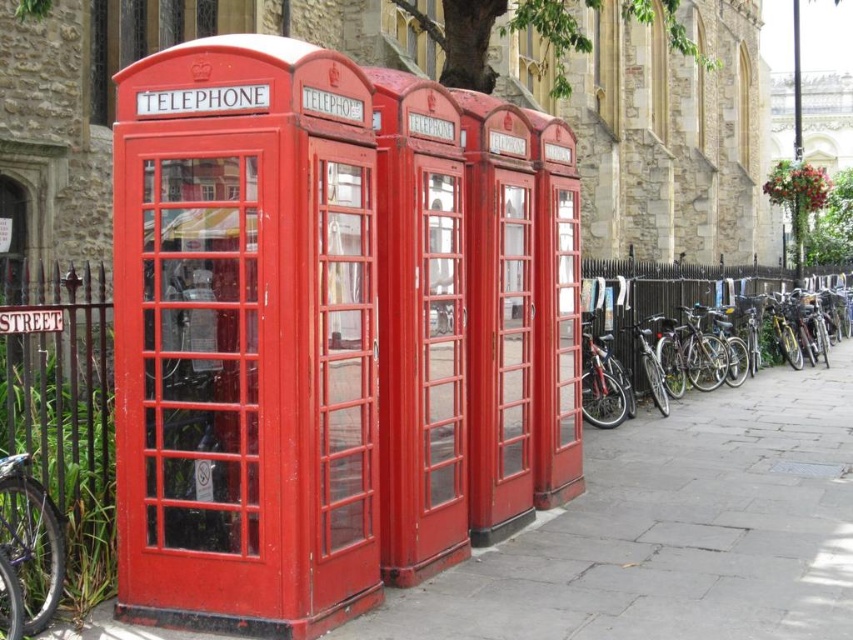
Is matte glass telephone booth at left below metallic purple bicycle at lower left?

Incorrect, matte glass telephone booth at left is not positioned below metallic purple bicycle at lower left.

Is matte glass telephone booth at left taller than metallic purple bicycle at lower left?

Yes.

Find the location of a particular element. The height and width of the screenshot is (640, 853). matte glass telephone booth at left is located at coordinates (245, 339).

Locate an element on the screen. matte glass telephone booth at left is located at coordinates (245, 339).

Which is below, smooth concrete pavement at lower center or shiny metallic bicycle at right?

Positioned lower is smooth concrete pavement at lower center.

Which is in front, point (595, 492) or point (595, 291)?

Point (595, 492)

Where is `smooth concrete pavement at lower center`? Image resolution: width=853 pixels, height=640 pixels. smooth concrete pavement at lower center is located at coordinates (672, 531).

Can you confirm if matte glass telephone booth at left is shorter than shiny metallic bicycle at right?

Incorrect, matte glass telephone booth at left's height does not fall short of shiny metallic bicycle at right's.

Based on the photo, is matte glass telephone booth at left bigger than shiny metallic bicycle at right?

No, matte glass telephone booth at left is not bigger than shiny metallic bicycle at right.

Which is in front, point (248, 116) or point (663, 356)?

Point (248, 116) is in front.

Where is `matte glass telephone booth at left`? The height and width of the screenshot is (640, 853). matte glass telephone booth at left is located at coordinates (245, 339).